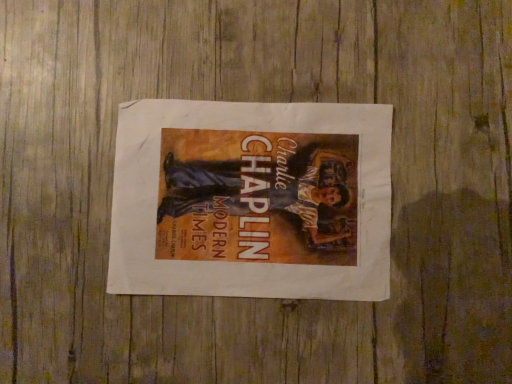
In order to click on blank space situated above matte paper poster at center (from a real-world perspective) in this screenshot , I will do `click(244, 196)`.